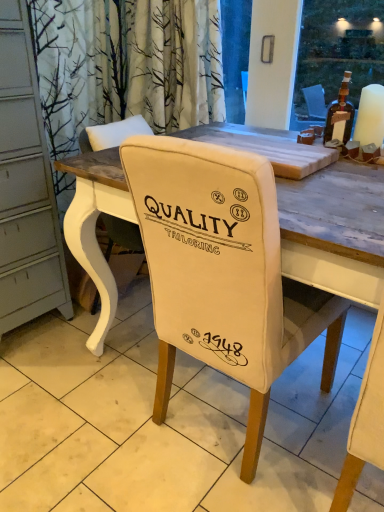
Where is `vacant point to the left of white fabric chair at center`? This screenshot has width=384, height=512. vacant point to the left of white fabric chair at center is located at coordinates (86, 409).